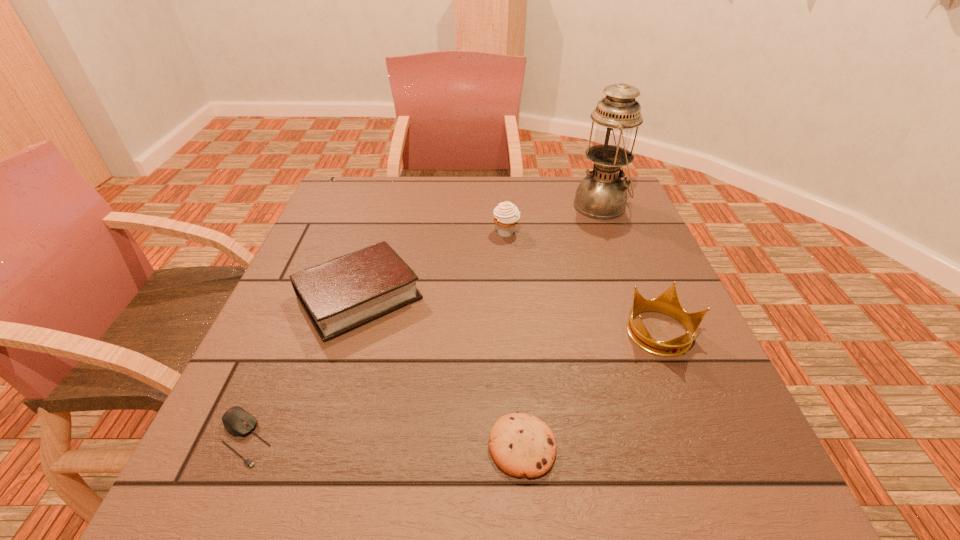
What are the coordinates of `the tallest object` in the screenshot? It's located at (602, 195).

Identify the location of the farthest object. The image size is (960, 540). (602, 195).

At what (x,y) coordinates should I click in order to perform the action: click on muffin. Please return your answer as a coordinate pair (x, y). The height and width of the screenshot is (540, 960). Looking at the image, I should click on (506, 215).

Where is `the second farthest object`? the second farthest object is located at coordinates pos(506,215).

Find the location of a particular element. The width and height of the screenshot is (960, 540). the fourth shortest object is located at coordinates (668, 302).

Find the location of a particular element. Image resolution: width=960 pixels, height=540 pixels. Bible is located at coordinates (338, 295).

Locate an element on the screen. The image size is (960, 540). the fifth tallest object is located at coordinates (521, 445).

Locate an element on the screen. The height and width of the screenshot is (540, 960). mouse is located at coordinates (238, 422).

This screenshot has height=540, width=960. I want to click on free space located 0.070m on the back of the farthest object, so click(591, 181).

Find the location of `vacant space located 0.190m on the back of the muffin`. vacant space located 0.190m on the back of the muffin is located at coordinates [503, 190].